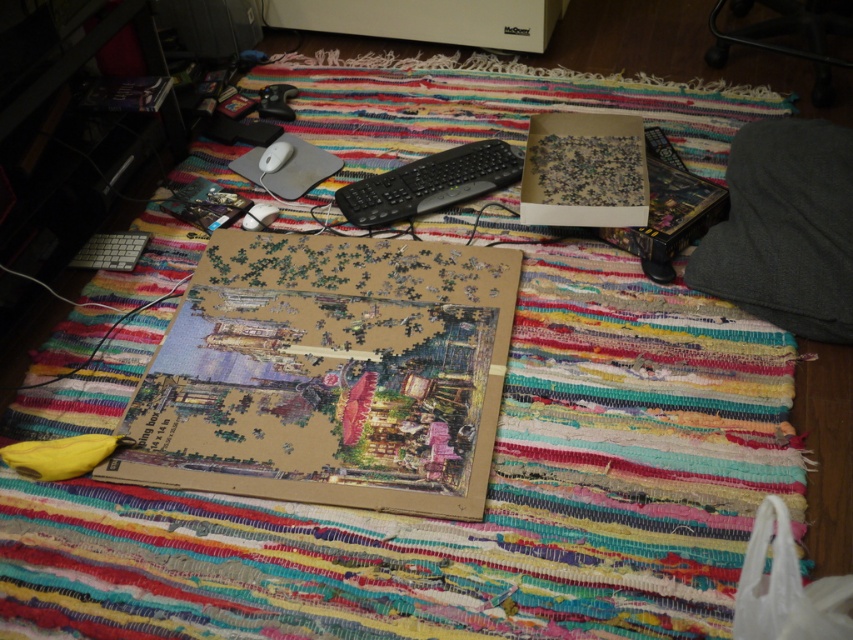
You are organizing items on a rug and see the wooden jigsaw puzzle at center and the cardboard puzzle box at center. Which item is located to the left of the other?

The wooden jigsaw puzzle at center is positioned on the left side of the cardboard puzzle box at center.

Looking at this image, where is the wooden jigsaw puzzle at center located?

The wooden jigsaw puzzle at center is located at point (328, 374).